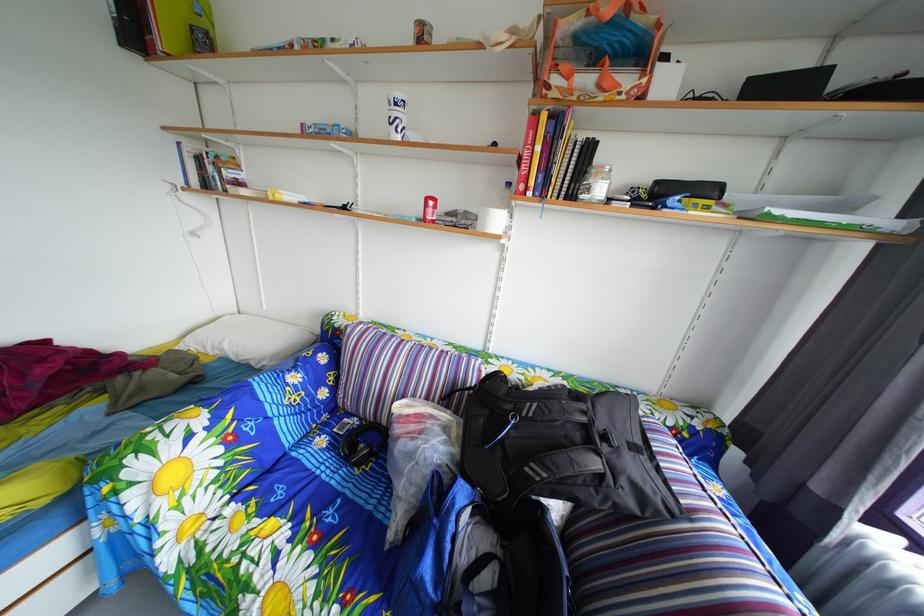
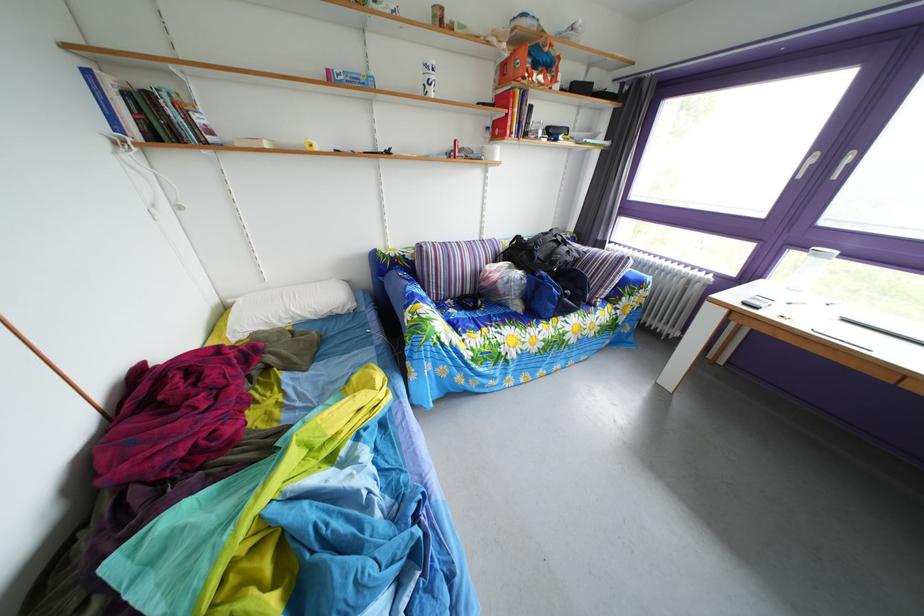
The point at (233, 351) is marked in the first image. Where is the corresponding point in the second image?

(298, 320)